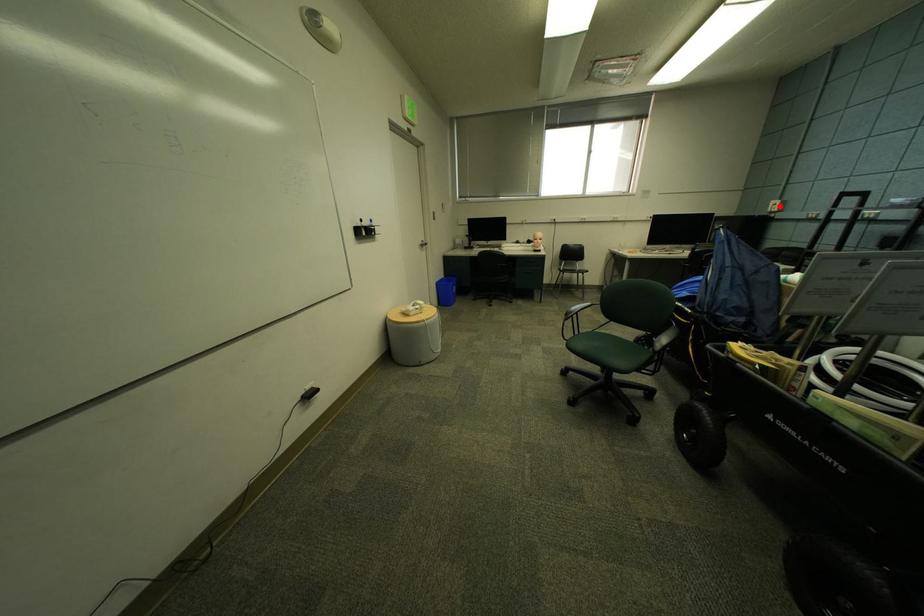
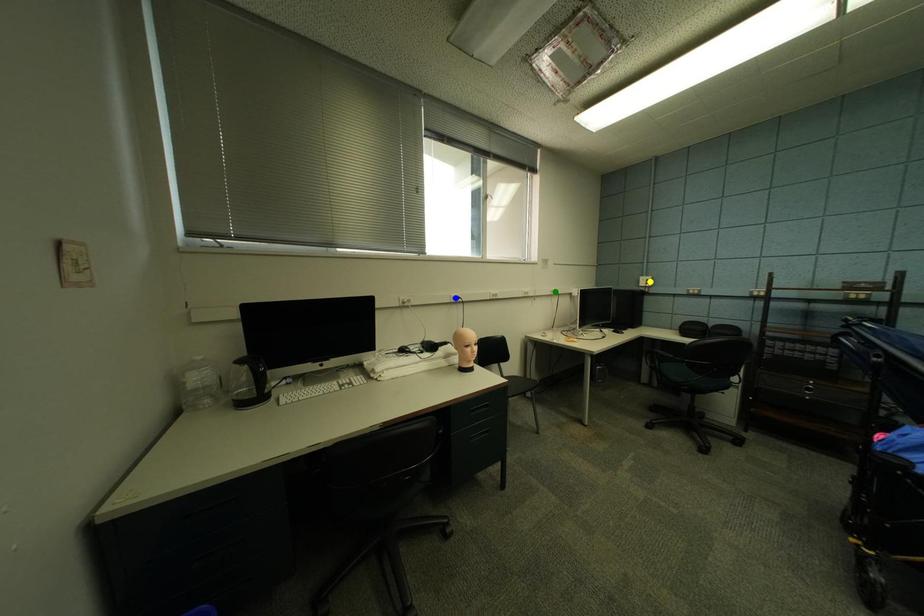
Question: I am providing you with two images of the same scene from different viewpoints. A red point is marked on the first image. You are given multiple points on the second image. Can you choose the point in image 2 that corresponds to the point in image 1?

Choices:
 (A) blue point
 (B) green point
 (C) yellow point

Answer: (C)